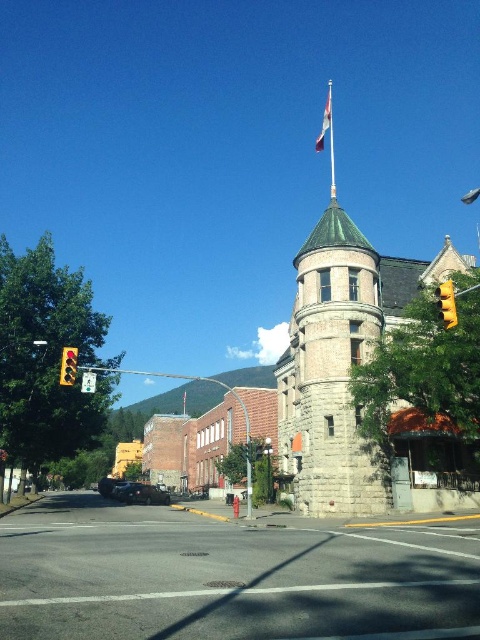
Which is below, gray stone tower at center or shiny black sedan at center?

shiny black sedan at center

Can you confirm if gray stone tower at center is positioned below shiny black sedan at center?

No, gray stone tower at center is not below shiny black sedan at center.

Find the location of a particular element. This screenshot has width=480, height=640. gray stone tower at center is located at coordinates (330, 371).

Who is taller, gray stone tower at center or metallic flag pole at center?

With more height is gray stone tower at center.

Measure the distance between point (x=350, y=278) and camera.

Point (x=350, y=278) and camera are 52.31 meters apart from each other.

In order to click on gray stone tower at center in this screenshot , I will do `click(330, 371)`.

Is gray stone building at center closer to the viewer compared to yellow matte traffic light at right?

Yes, gray stone building at center is closer to the viewer.

Does gray stone building at center appear over yellow matte traffic light at right?

No, gray stone building at center is not above yellow matte traffic light at right.

Does point (9, 618) come in front of point (454, 300)?

Yes, it is.

Where is `gray stone building at center`? gray stone building at center is located at coordinates (227, 577).